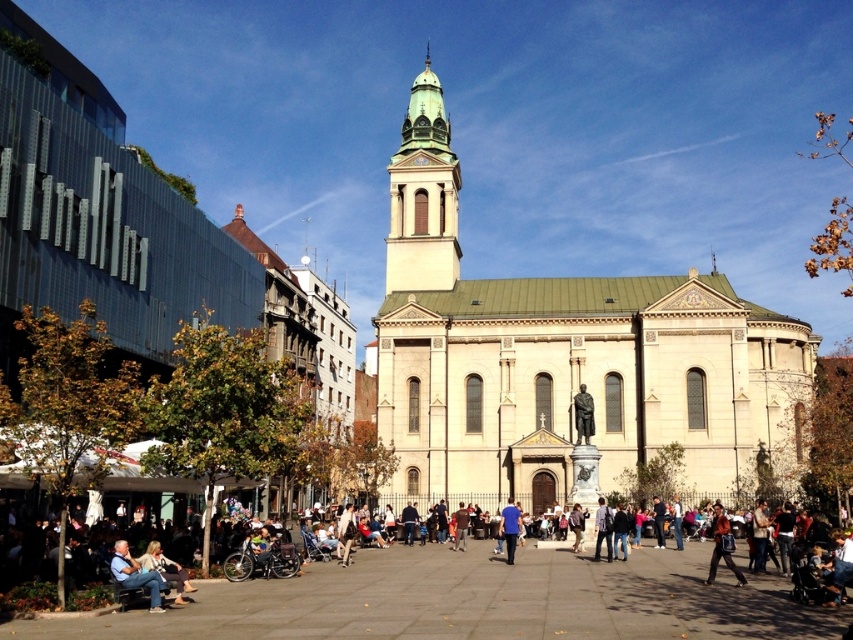
Can you confirm if green stone tower at center is positioned to the right of light brown leather jacket at center?

In fact, green stone tower at center is to the left of light brown leather jacket at center.

Is green stone tower at center positioned before light brown leather jacket at center?

No, it is not.

In order to click on green stone tower at center in this screenshot , I will do `click(422, 195)`.

Is point (151, 589) less distant than point (718, 548)?

Yes, point (151, 589) is in front of point (718, 548).

Locate an element on the screen. light brown leather bench at lower left is located at coordinates (136, 576).

Find the location of a particular element. This screenshot has width=853, height=640. light brown leather bench at lower left is located at coordinates (136, 576).

Can you confirm if green stone tower at center is smaller than blue fabric shirt at center?

Incorrect, green stone tower at center is not smaller in size than blue fabric shirt at center.

Looking at this image, is green stone tower at center shorter than blue fabric shirt at center?

No, green stone tower at center is not shorter than blue fabric shirt at center.

This screenshot has height=640, width=853. In order to click on green stone tower at center in this screenshot , I will do (422, 195).

What are the coordinates of `green stone tower at center` in the screenshot? It's located at (422, 195).